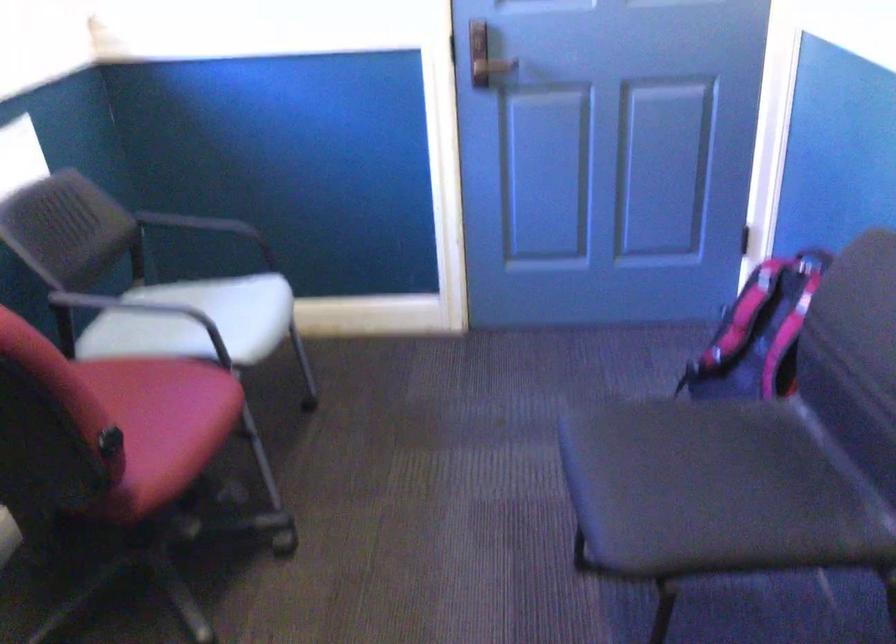
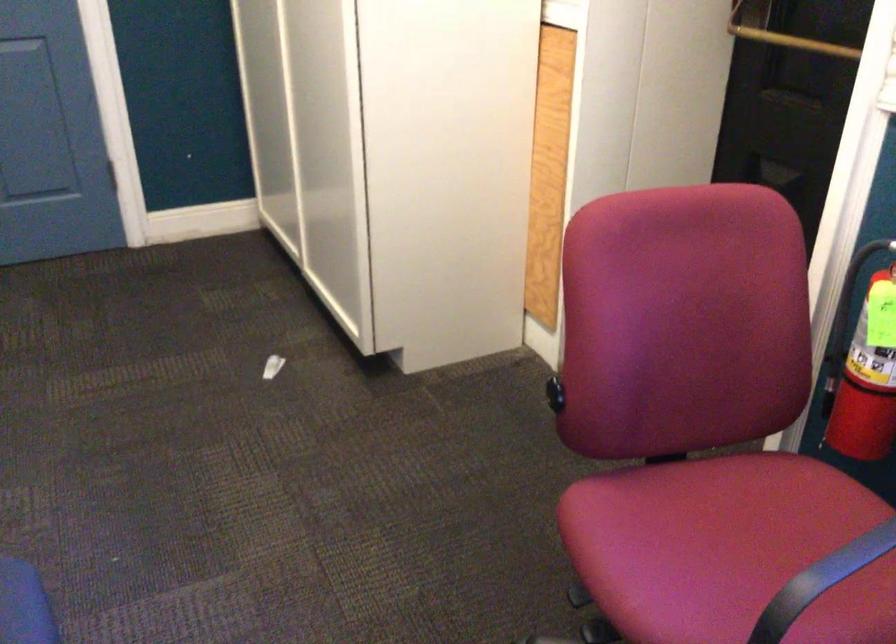
Locate, in the second image, the point that corresponds to (x=114, y=430) in the first image.

(555, 393)